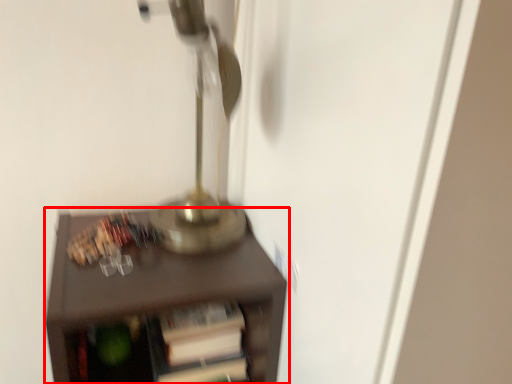
Question: From the image's perspective, what is the correct spatial relationship of furniture (annotated by the red box) in relation to table lamp?

Choices:
 (A) above
 (B) below

Answer: (B)